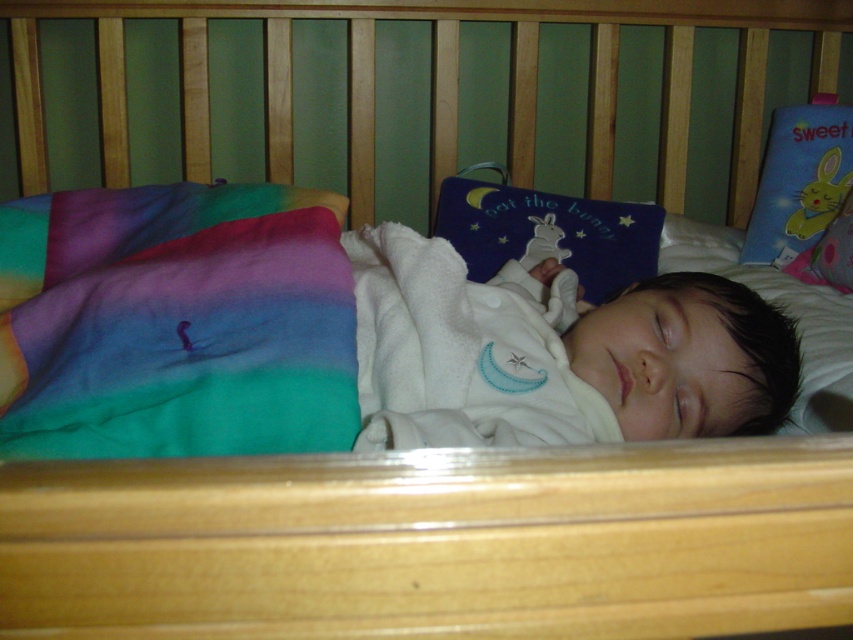
Consider the image. You are a parent holding a 40 cm long stuffed animal. You want to place it on the multicolor fleece blanket at lower left so your baby can reach it. Can the stuffed animal fit entirely on the blanket?

The multicolor fleece blanket at lower left is 51.64 centimeters from camera, so the stuffed animal which is 40 cm long can fit entirely on the blanket since it is shorter than the blanket.

You are a parent checking on your baby in the crib. You notice the multicolor fleece blanket at lower left and the white soft baby at center. Which object is closer to you when you look into the crib?

The multicolor fleece blanket at lower left is closer to you because it is in front of the white soft baby at center.